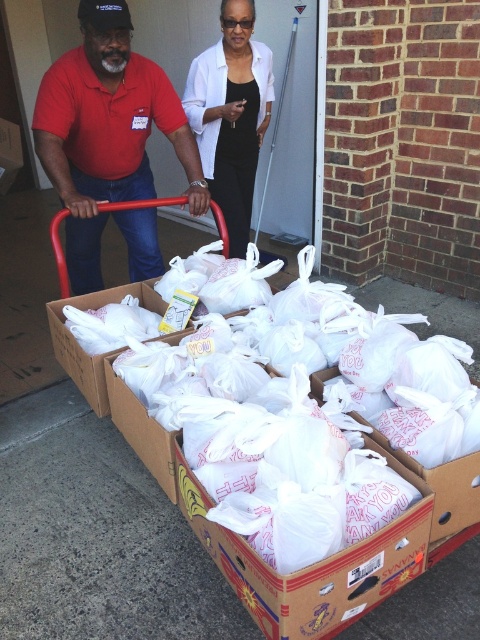
You are a photographer trying to capture both the matte red shirt at center and the black satin blouse at upper center in a single shot. Based on their positions, which one would you need to focus on first to ensure both are in frame?

The matte red shirt at center is positioned under the black satin blouse at upper center, so you should focus on the black satin blouse at upper center first to ensure both are in frame.

You are a photographer trying to capture both the matte red shirt at center and the black satin blouse at upper center in a single frame. Given their sizes, which one should you focus on to ensure both are clearly visible?

The matte red shirt at center is larger in size than the black satin blouse at upper center, so focusing on the matte red shirt at center would ensure both are clearly visible as it occupies more space in the frame.

You are a photographer taking a picture of the matte red shirt at center and the black satin blouse at upper center. Which one should you adjust the focus on first if you want to ensure both are in focus, considering their positions?

The matte red shirt at center is shorter than the black satin blouse at upper center, so you should focus on the black satin blouse at upper center first to ensure both are in focus.